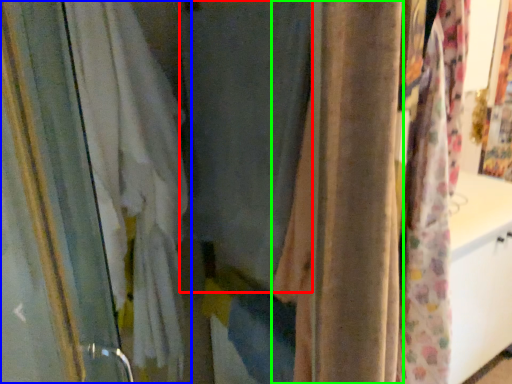
Question: Which is nearer to the curtain (highlighted by a red box)? curtain (highlighted by a blue box) or curtain (highlighted by a green box).

Choices:
 (A) curtain
 (B) curtain

Answer: (B)